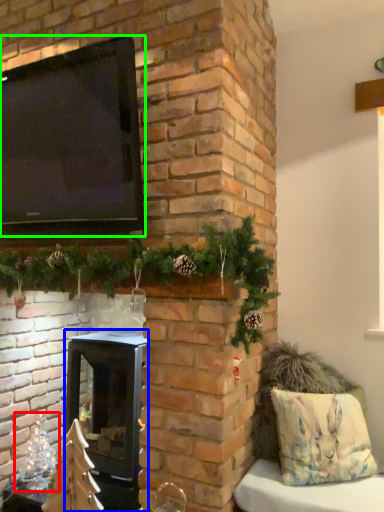
Question: Based on their relative distances, which object is nearer to christmas decoration (highlighted by a red box)? Choose from wood burning stove (highlighted by a blue box) and window screen (highlighted by a green box).

Choices:
 (A) wood burning stove
 (B) window screen

Answer: (A)